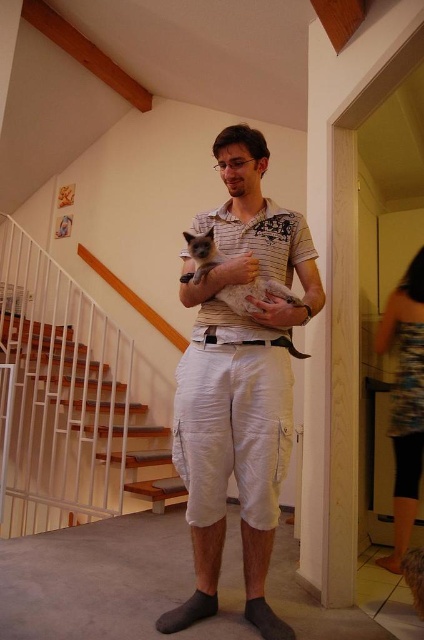
Question: Can you confirm if white cotton pants at center is smaller than wooden stairs at lower left?

Choices:
 (A) yes
 (B) no

Answer: (A)

Question: Which point appears farthest from the camera in this image?

Choices:
 (A) (206, 240)
 (B) (145, 461)

Answer: (B)

Question: Can you confirm if wooden stairs at lower left is positioned below silvery fur cat at center?

Choices:
 (A) yes
 (B) no

Answer: (A)

Question: Can you confirm if white cotton pants at center is positioned to the right of silvery fur cat at center?

Choices:
 (A) no
 (B) yes

Answer: (A)

Question: Which point is farther to the camera?

Choices:
 (A) white cotton pants at center
 (B) wooden stairs at lower left
 (C) silvery fur cat at center

Answer: (B)

Question: Which object is closer to the camera taking this photo?

Choices:
 (A) wooden stairs at lower left
 (B) white cotton pants at center

Answer: (B)